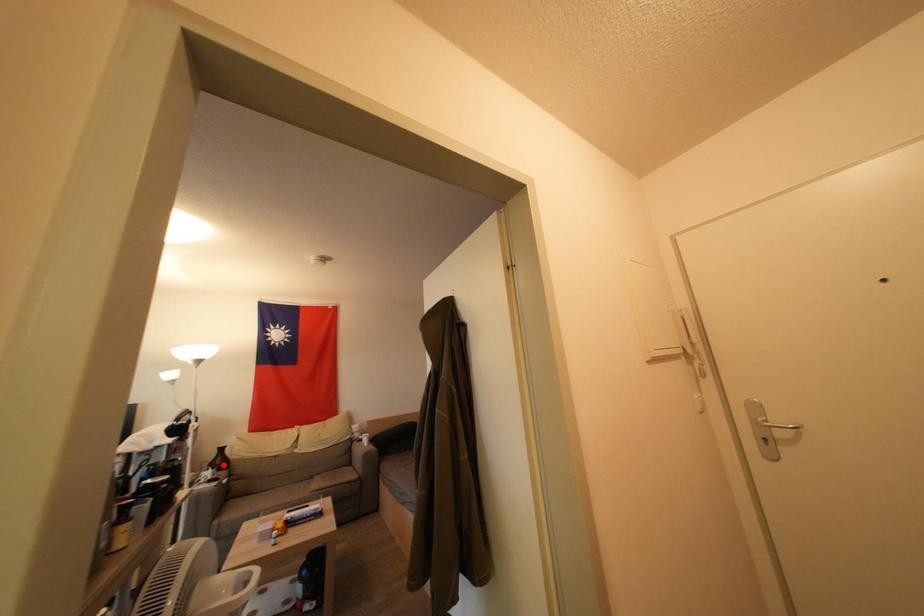
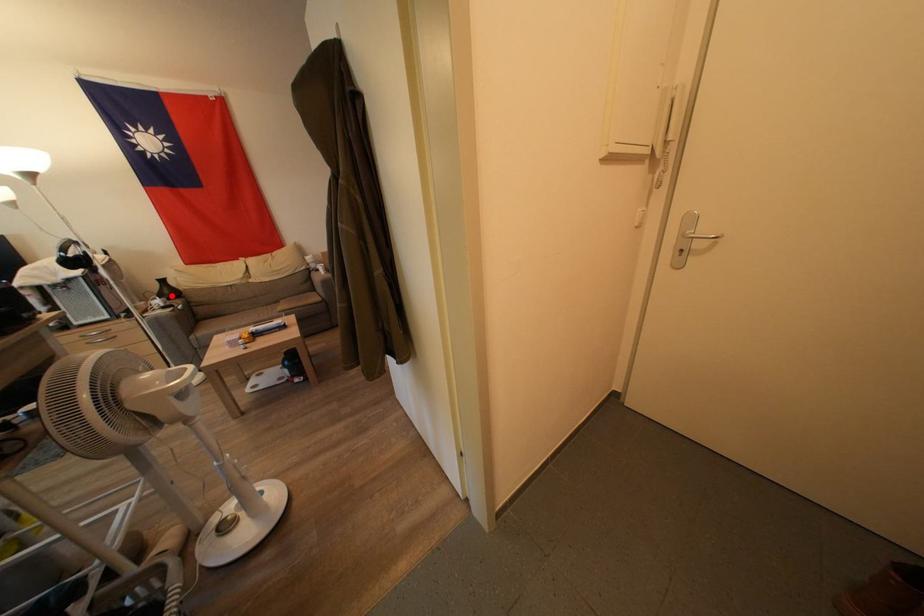
I am providing you with two images of the same scene from different viewpoints. A red point is marked on the first image and another point is marked on the second image. Does the point marked in image1 correspond to the same location as the one in image2?

Yes